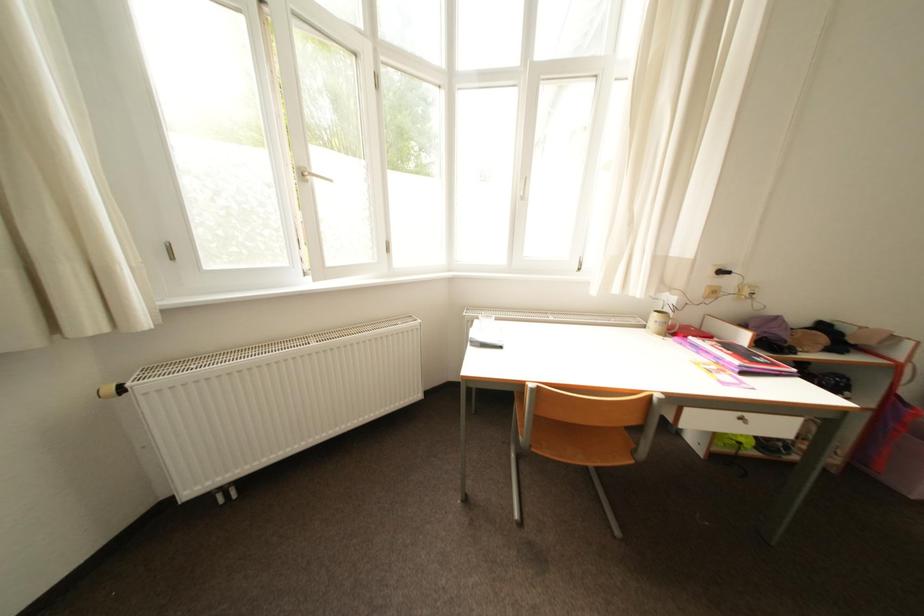
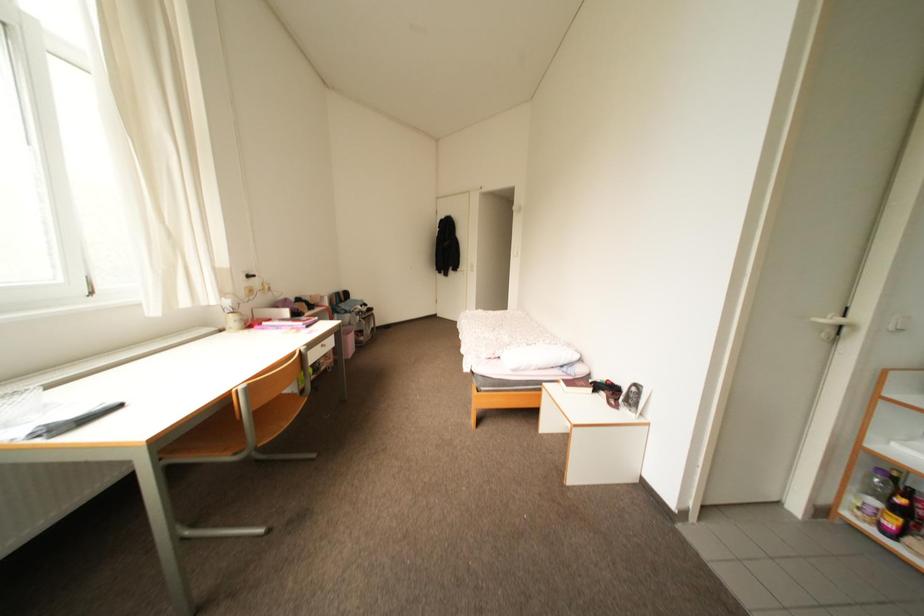
Question: The first image is from the beginning of the video and the second image is from the end. How did the camera likely rotate when shooting the video?

Choices:
 (A) Left
 (B) Right
 (C) Up
 (D) Down

Answer: (B)